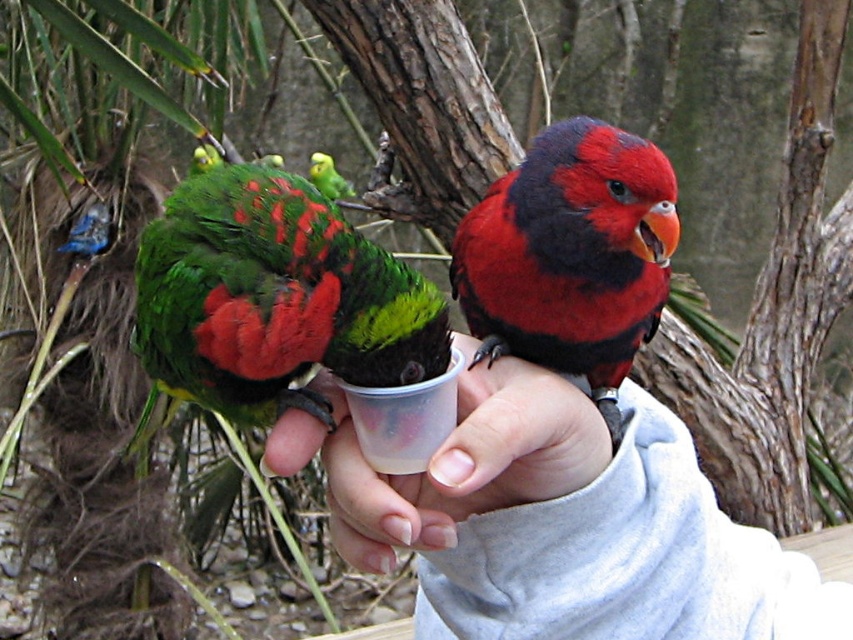
From the picture: Is shiny red parrot at center closer to camera compared to green glossy parrot at center?

Yes, shiny red parrot at center is closer to the viewer.

Who is more distant from viewer, (550, 269) or (344, 182)?

The point (344, 182) is behind.

Image resolution: width=853 pixels, height=640 pixels. Identify the location of shiny red parrot at center. (572, 257).

Does green matte parrot at center have a lesser width compared to clear plastic cup at center?

Incorrect, green matte parrot at center's width is not less than clear plastic cup at center's.

Consider the image. Does green matte parrot at center have a greater width compared to clear plastic cup at center?

Yes, green matte parrot at center is wider than clear plastic cup at center.

Between point (305, 305) and point (492, 376), which one is positioned in front?

Positioned in front is point (305, 305).

Where is `green matte parrot at center`? This screenshot has height=640, width=853. green matte parrot at center is located at coordinates (273, 300).

How much distance is there between smooth plastic cup at center and green matte parrot at upper left?

A distance of 1.53 meters exists between smooth plastic cup at center and green matte parrot at upper left.

Which is behind, point (675, 433) or point (196, 157)?

Point (196, 157)

Image resolution: width=853 pixels, height=640 pixels. What are the coordinates of `smooth plastic cup at center` in the screenshot? It's located at (560, 522).